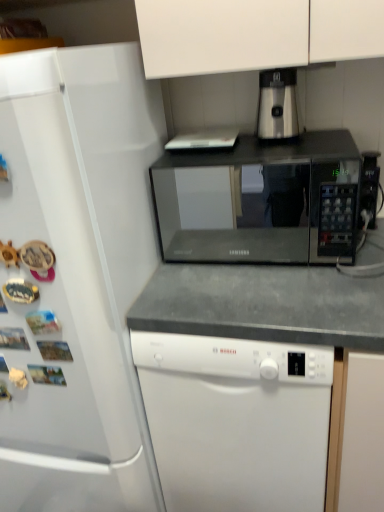
Identify the location of blank space situated above white matte dishwasher at center (from a real-world perspective). (243, 270).